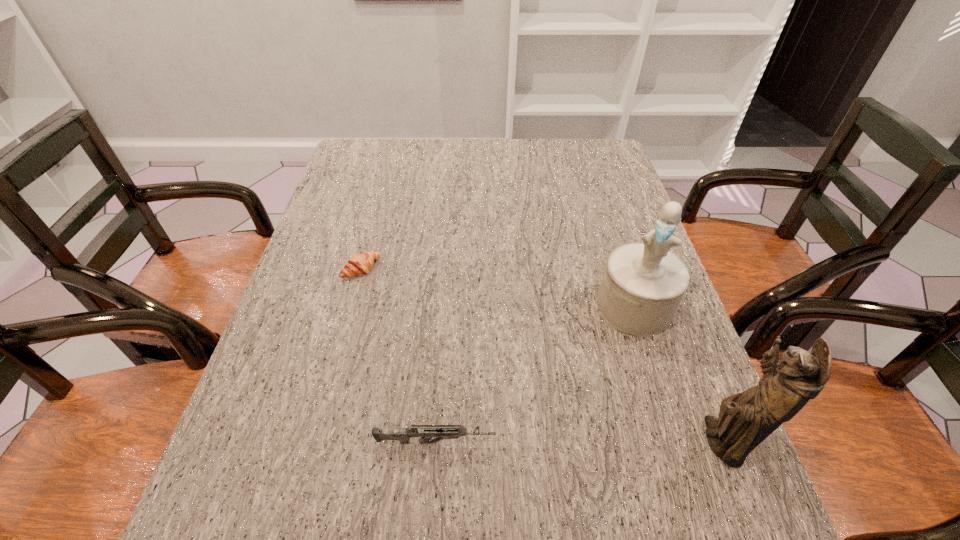
At what (x,y) coordinates should I click in order to perform the action: click on vacant space located at the beak of the farther figurine. Please return your answer as a coordinate pair (x, y). Looking at the image, I should click on (580, 436).

In order to click on free space located at the beak of the farther figurine in this screenshot , I will do `click(584, 427)`.

Where is `vacant region located 0.190m at the beak of the farther figurine`? The image size is (960, 540). vacant region located 0.190m at the beak of the farther figurine is located at coordinates (594, 401).

Image resolution: width=960 pixels, height=540 pixels. I want to click on free space located on the front-facing side of the leftmost object, so click(487, 376).

Identify the location of free region located on the front-facing side of the leftmost object. This screenshot has width=960, height=540. (431, 329).

The height and width of the screenshot is (540, 960). What are the coordinates of `vacant space located on the front-facing side of the leftmost object` in the screenshot? It's located at (425, 324).

I want to click on gun positioned at the near edge, so (x=425, y=432).

Locate an element on the screen. The height and width of the screenshot is (540, 960). figurine situated at the near edge is located at coordinates (745, 419).

You are a GUI agent. You are given a task and a screenshot of the screen. Output one action in this format:
    pyautogui.click(x=<x>, y=<y>)
    Task: Click on the object located at the left edge
    
    Given the screenshot: What is the action you would take?
    pyautogui.click(x=358, y=265)

This screenshot has height=540, width=960. Find the location of `object present at the near right corner`. object present at the near right corner is located at coordinates (745, 419).